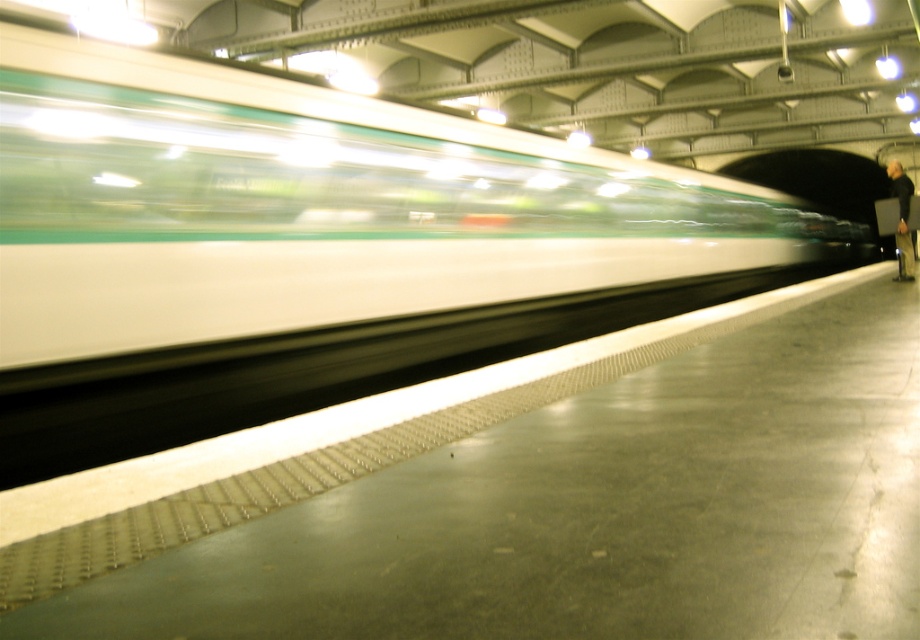
Question: Is the position of white glossy train at center less distant than that of dark gray jacket at right?

Choices:
 (A) yes
 (B) no

Answer: (A)

Question: Among these points, which one is nearest to the camera?

Choices:
 (A) (901, 198)
 (B) (500, 266)

Answer: (B)

Question: Where is white glossy train at center located in relation to dark gray jacket at right in the image?

Choices:
 (A) right
 (B) left

Answer: (B)

Question: Which object is farther from the camera taking this photo?

Choices:
 (A) dark gray jacket at right
 (B) white glossy train at center

Answer: (A)

Question: Considering the relative positions of white glossy train at center and dark gray jacket at right in the image provided, where is white glossy train at center located with respect to dark gray jacket at right?

Choices:
 (A) below
 (B) above

Answer: (A)